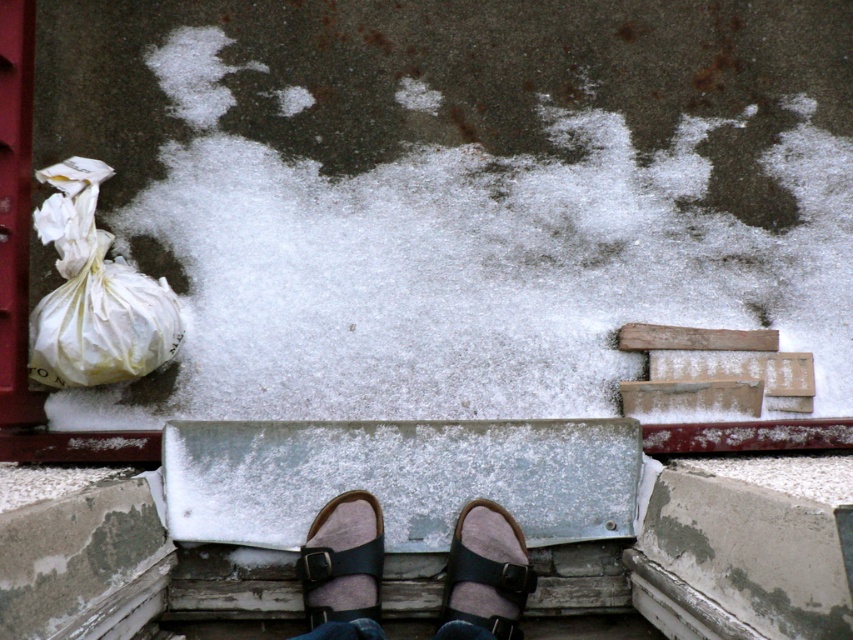
Looking at this image, between white paper bag at left and leather sandals at center, which one has less height?

leather sandals at center is shorter.

Is white paper bag at left in front of leather sandals at center?

No, it is behind leather sandals at center.

Between point (41, 372) and point (496, 547), which one is positioned in front?

Point (496, 547) is more forward.

I want to click on white paper bag at left, so click(94, 292).

Looking at this image, is white paper bag at left positioned at the back of black leather sandal at center?

Yes.

Is point (135, 324) positioned after point (523, 580)?

Yes.

Measure the distance between white paper bag at left and camera.

2.26 meters

The image size is (853, 640). Find the location of `white paper bag at left`. white paper bag at left is located at coordinates (94, 292).

Can you confirm if white powder snow at center is bigger than leather sandals at center?

Correct, white powder snow at center is larger in size than leather sandals at center.

This screenshot has height=640, width=853. What do you see at coordinates (462, 204) in the screenshot? I see `white powder snow at center` at bounding box center [462, 204].

This screenshot has width=853, height=640. What do you see at coordinates (462, 204) in the screenshot?
I see `white powder snow at center` at bounding box center [462, 204].

You are a GUI agent. You are given a task and a screenshot of the screen. Output one action in this format:
    pyautogui.click(x=<x>, y=<y>)
    Task: Click on the white powder snow at center
    The width and height of the screenshot is (853, 640).
    Given the screenshot: What is the action you would take?
    pyautogui.click(x=462, y=204)